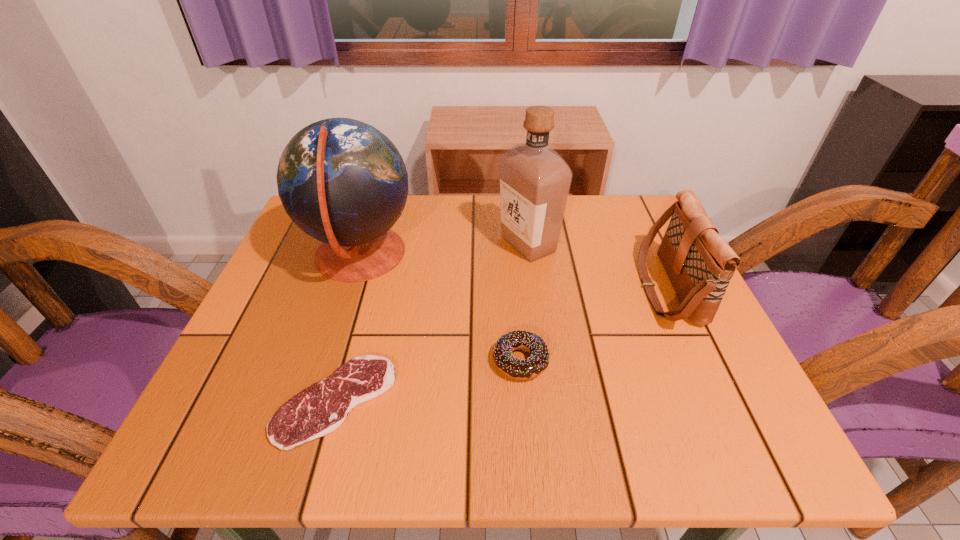
Where is `liquor`? This screenshot has width=960, height=540. liquor is located at coordinates (535, 180).

The height and width of the screenshot is (540, 960). What are the coordinates of `globe` in the screenshot? It's located at (343, 182).

Where is `the third shortest object`? This screenshot has height=540, width=960. the third shortest object is located at coordinates (699, 263).

Find the location of a particular element. shoulder bag is located at coordinates (699, 263).

Find the location of `doughnut`. doughnut is located at coordinates (538, 361).

You are a GUI agent. You are given a task and a screenshot of the screen. Output one action in this format:
    pyautogui.click(x=<x>, y=<y>)
    Task: Click on the shortest object
    The width and height of the screenshot is (960, 540).
    Given the screenshot: What is the action you would take?
    pyautogui.click(x=320, y=409)

Where is `vacant area situated 0.080m on the front-facing side of the liquor`? vacant area situated 0.080m on the front-facing side of the liquor is located at coordinates (464, 244).

I want to click on vacant point located 0.380m on the front-facing side of the liquor, so click(337, 244).

The width and height of the screenshot is (960, 540). I want to click on vacant space positioned on the front-facing side of the liquor, so click(x=425, y=244).

I want to click on vacant point located with the Americas facing the viewer on the globe, so click(x=459, y=255).